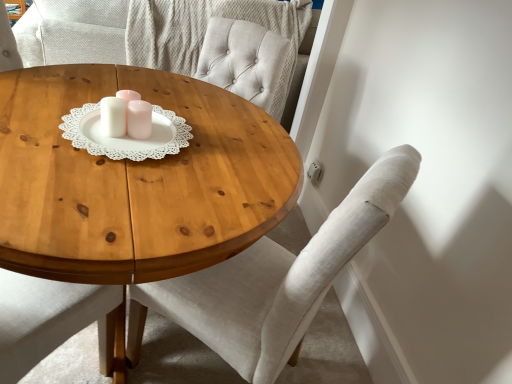
Identify the location of free space to the left of white glossy candle holder at center. (63, 114).